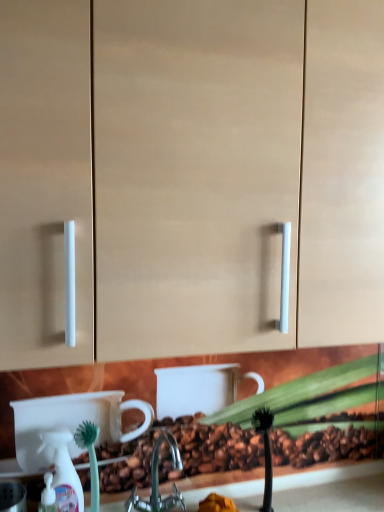
Question: From a real-world perspective, is white plastic spray bottle at lower left beneath metallic silver faucet at center?

Choices:
 (A) yes
 (B) no

Answer: (B)

Question: Does white plastic spray bottle at lower left lie in front of metallic silver faucet at center?

Choices:
 (A) no
 (B) yes

Answer: (A)

Question: Does white plastic spray bottle at lower left have a smaller size compared to metallic silver faucet at center?

Choices:
 (A) yes
 (B) no

Answer: (A)

Question: From the image's perspective, does white plastic spray bottle at lower left appear lower than metallic silver faucet at center?

Choices:
 (A) no
 (B) yes

Answer: (A)

Question: Is white plastic spray bottle at lower left taller than metallic silver faucet at center?

Choices:
 (A) no
 (B) yes

Answer: (B)

Question: Is white plastic spray bottle at lower left outside of metallic silver faucet at center?

Choices:
 (A) no
 (B) yes

Answer: (B)

Question: Is green bristle brush at lower left surrounding white plastic spray bottle at lower left?

Choices:
 (A) yes
 (B) no

Answer: (B)

Question: From a real-world perspective, is green bristle brush at lower left on top of white plastic spray bottle at lower left?

Choices:
 (A) yes
 (B) no

Answer: (B)

Question: Is the position of green bristle brush at lower left more distant than that of white plastic spray bottle at lower left?

Choices:
 (A) no
 (B) yes

Answer: (B)

Question: Is green bristle brush at lower left thinner than white plastic spray bottle at lower left?

Choices:
 (A) yes
 (B) no

Answer: (B)

Question: Is green bristle brush at lower left not close to white plastic spray bottle at lower left?

Choices:
 (A) no
 (B) yes

Answer: (A)

Question: Is green bristle brush at lower left completely or partially outside of white plastic spray bottle at lower left?

Choices:
 (A) yes
 (B) no

Answer: (A)

Question: Does metallic silver faucet at center have a lesser height compared to matte beige cabinet at center?

Choices:
 (A) no
 (B) yes

Answer: (B)